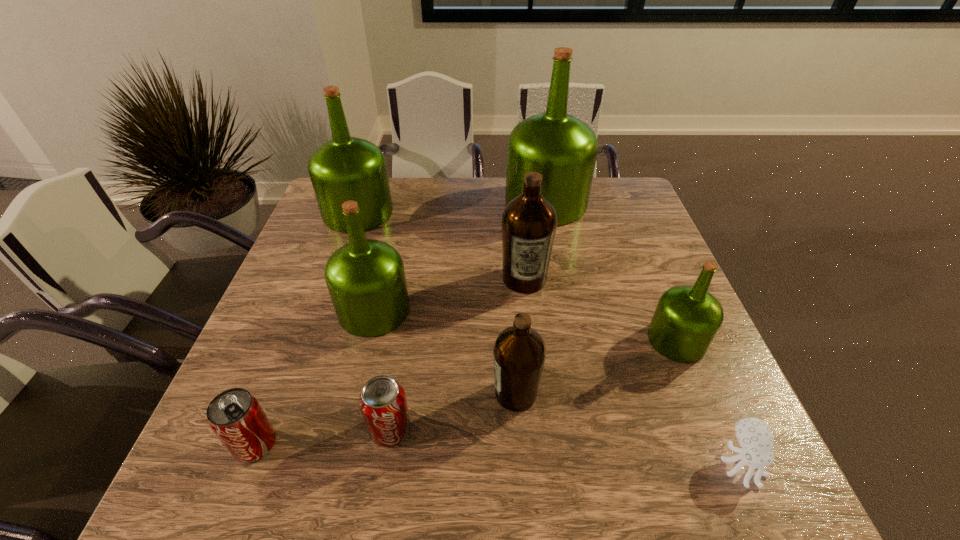
Identify the location of object present at the far left corner. (345, 168).

Identify the location of object situated at the near left corner. Image resolution: width=960 pixels, height=540 pixels. (236, 417).

Identify the location of object present at the near right corner. (754, 435).

You are a GUI agent. You are given a task and a screenshot of the screen. Output one action in this format:
    pyautogui.click(x=<x>, y=<y>)
    Task: Click on the vacant space at the far edge of the desktop
    The image size is (960, 540).
    Given the screenshot: What is the action you would take?
    (396, 202)

The height and width of the screenshot is (540, 960). In the image, there is a desktop. Find the location of `vacant space at the near edge`. vacant space at the near edge is located at coordinates (625, 500).

In the image, there is a desktop. Where is `vacant space at the left edge`? This screenshot has width=960, height=540. vacant space at the left edge is located at coordinates (294, 306).

Find the location of a particular element. vacant point at the right edge is located at coordinates (649, 311).

At what (x,y) coordinates should I click in order to perform the action: click on free region at the far right corner of the desktop. Please return your answer as a coordinate pair (x, y). The height and width of the screenshot is (540, 960). Looking at the image, I should click on click(x=591, y=200).

Where is `vacant space that is in between the red pop soda and the rightmost olive oil`? The image size is (960, 540). vacant space that is in between the red pop soda and the rightmost olive oil is located at coordinates (466, 392).

The height and width of the screenshot is (540, 960). What are the coordinates of `vacant area that lies between the tallest olive oil and the rightmost olive oil` in the screenshot? It's located at (612, 272).